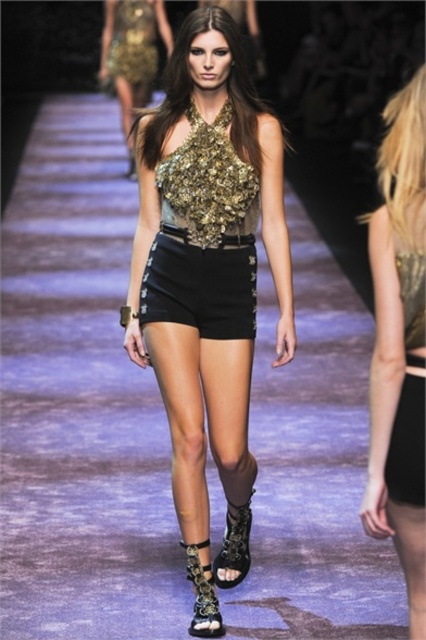
Question: Among these points, which one is farthest from the camera?

Choices:
 (A) (198, 563)
 (B) (169, 236)
 (C) (215, 561)
 (D) (195, 456)

Answer: (C)

Question: Which of these objects is positioned closest to the leather/golden-patterned boot at lower center?

Choices:
 (A) black matte shorts at lower right
 (B) leather lace boot at lower center
 (C) shiny metallic shorts at center
 (D) black leather shorts at center

Answer: (B)

Question: Is gold sequined dress at upper center bigger than leather lace boot at lower center?

Choices:
 (A) no
 (B) yes

Answer: (B)

Question: From the image, what is the correct spatial relationship of black leather shorts at center in relation to gold sequined dress at upper center?

Choices:
 (A) below
 (B) above

Answer: (A)

Question: Estimate the real-world distances between objects in this image. Which object is closer to the black leather shorts at right?

Choices:
 (A) leather lace boot at lower center
 (B) black leather shorts at center
 (C) metallic gold top at upper center

Answer: (B)

Question: Is black leather shorts at center thinner than leather lace boot at lower center?

Choices:
 (A) no
 (B) yes

Answer: (A)